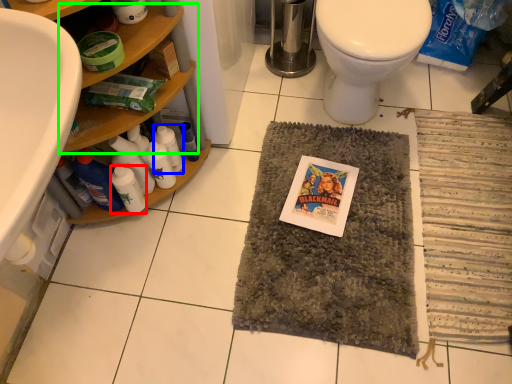
Question: Based on their relative distances, which object is farther from bottle (highlighted by a red box)? Choose from bottle (highlighted by a blue box) and shelf (highlighted by a green box).

Choices:
 (A) bottle
 (B) shelf

Answer: (B)